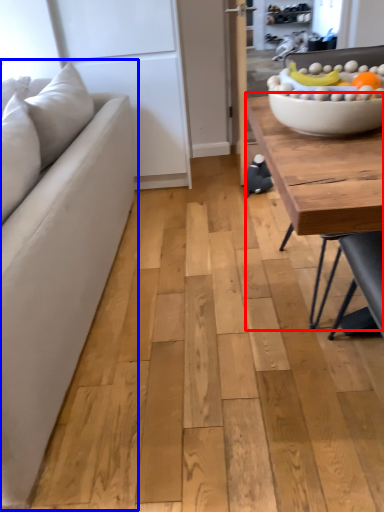
Question: Among these objects, which one is nearest to the camera, coffee table (highlighted by a red box) or studio couch (highlighted by a blue box)?

Choices:
 (A) coffee table
 (B) studio couch

Answer: (B)